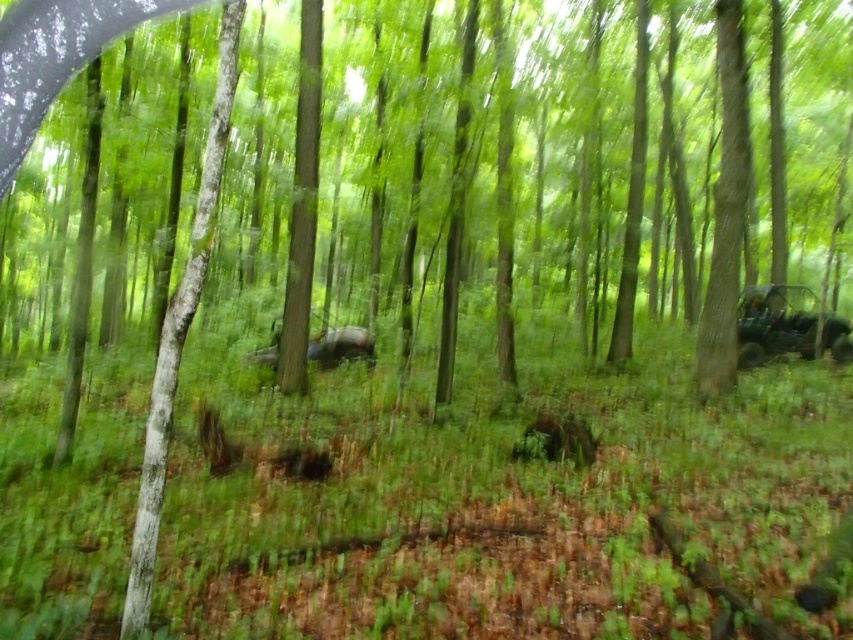
Looking at this image, you are a hiker who wants to take a photo of both the green matte jeep at right and the green matte car at center. Since you have a limited field of view, which vehicle should you focus on first to ensure both are in the frame?

You should focus on the green matte car at center first because the green matte jeep at right is located above it, so adjusting your angle to include the higher positioned jeep while keeping the car in view would require a wider upward perspective.

Based on the photo, you are a hiker who wants to take a photo of the forest. You have a green matte jeep at right and a green matte car at center in your viewfinder. Which vehicle should you focus on if you want to capture the one that is taller?

The green matte jeep at right is taller than the green matte car at center, so you should focus on the green matte jeep at right to capture the taller vehicle.